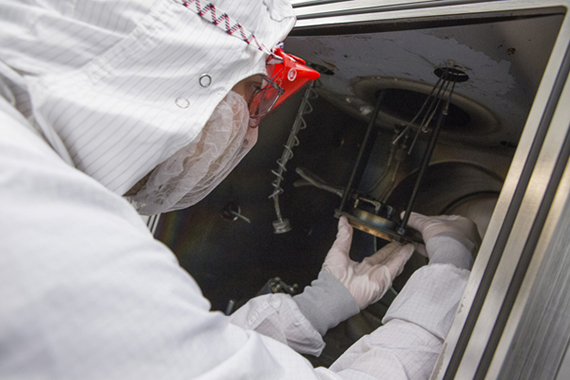
Find the location of a particular element. side wall is located at coordinates (237, 268).